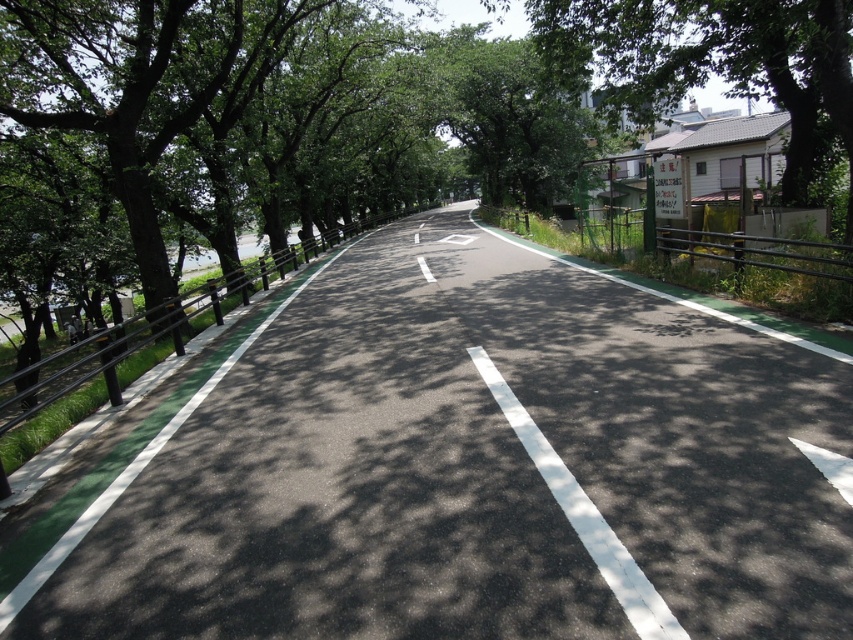
Question: Does green leafy tree at upper right lie in front of white asphalt road at center?

Choices:
 (A) yes
 (B) no

Answer: (B)

Question: Is asphalt at left smaller than green leafy tree at upper right?

Choices:
 (A) yes
 (B) no

Answer: (A)

Question: Which of the following is the closest to the observer?

Choices:
 (A) (804, 148)
 (B) (527, 349)
 (C) (564, 476)

Answer: (C)

Question: Which of the following is the farthest from the observer?

Choices:
 (A) (509, 401)
 (B) (582, 13)
 (C) (236, 508)

Answer: (B)

Question: Which point is farther to the camera?

Choices:
 (A) 680,72
 (B) 258,420
 (C) 548,477

Answer: (A)

Question: Can you confirm if green leafy tree at upper right is positioned to the right of white asphalt road at center?

Choices:
 (A) no
 (B) yes

Answer: (B)